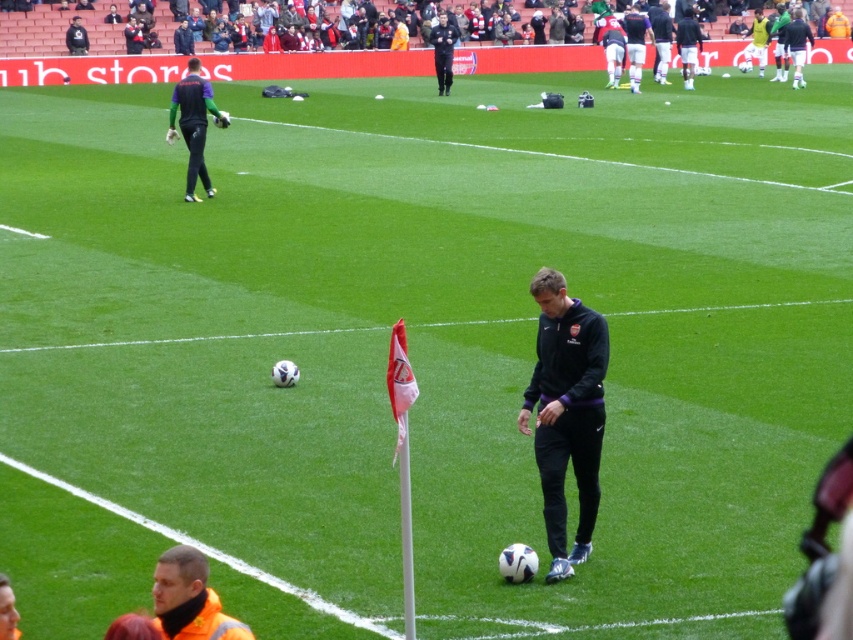
Does reflective orange vest at lower center appear over dark green jersey at upper left?

Incorrect, reflective orange vest at lower center is not positioned above dark green jersey at upper left.

Is reflective orange vest at lower center shorter than dark green jersey at upper left?

Correct, reflective orange vest at lower center is not as tall as dark green jersey at upper left.

This screenshot has height=640, width=853. I want to click on reflective orange vest at lower center, so click(190, 598).

Identify the location of reflective orange vest at lower center. The image size is (853, 640). (190, 598).

Who is positioned more to the right, black fleece jacket at center or dark green jersey at upper left?

From the viewer's perspective, black fleece jacket at center appears more on the right side.

Can you confirm if black fleece jacket at center is positioned above dark green jersey at upper left?

Actually, black fleece jacket at center is below dark green jersey at upper left.

Which is behind, point (552, 513) or point (199, 113)?

Point (199, 113)

The height and width of the screenshot is (640, 853). I want to click on black fleece jacket at center, so click(566, 412).

Can you confirm if black fleece jacket at center is taller than reflective orange vest at lower center?

Yes.

The image size is (853, 640). Identify the location of black fleece jacket at center. (566, 412).